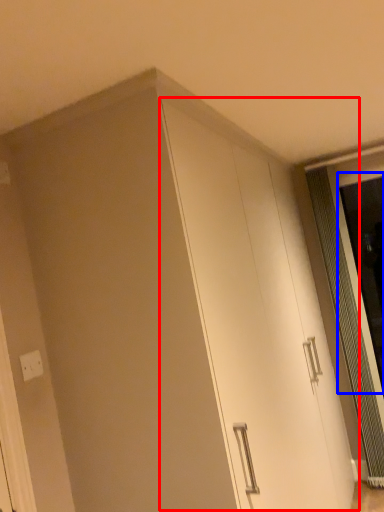
Question: Which point is further to the camera, cabinetry (highlighted by a red box) or screen door (highlighted by a blue box)?

Choices:
 (A) cabinetry
 (B) screen door

Answer: (B)